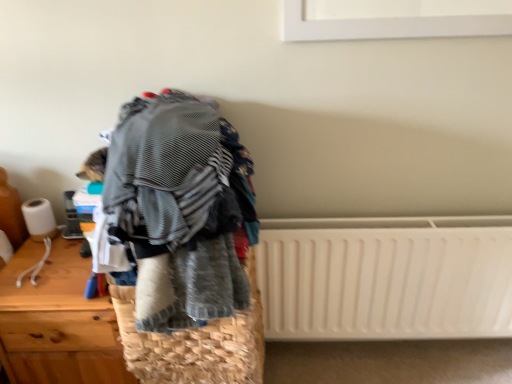
Question: Is wooden chest of drawers at left at the left side of striped fabric at center?

Choices:
 (A) no
 (B) yes

Answer: (B)

Question: Can you confirm if wooden chest of drawers at left is positioned to the right of striped fabric at center?

Choices:
 (A) yes
 (B) no

Answer: (B)

Question: Is wooden chest of drawers at left bigger than striped fabric at center?

Choices:
 (A) no
 (B) yes

Answer: (A)

Question: Does wooden chest of drawers at left have a lesser height compared to striped fabric at center?

Choices:
 (A) no
 (B) yes

Answer: (A)

Question: From the image's perspective, is wooden chest of drawers at left on top of striped fabric at center?

Choices:
 (A) no
 (B) yes

Answer: (A)

Question: Is wooden chest of drawers at left turned away from striped fabric at center?

Choices:
 (A) no
 (B) yes

Answer: (A)

Question: From the image's perspective, does woven straw basket at center appear lower than wooden chest of drawers at left?

Choices:
 (A) no
 (B) yes

Answer: (A)

Question: From a real-world perspective, is woven straw basket at center below wooden chest of drawers at left?

Choices:
 (A) no
 (B) yes

Answer: (A)

Question: Could you tell me if woven straw basket at center is turned towards wooden chest of drawers at left?

Choices:
 (A) yes
 (B) no

Answer: (B)

Question: Is woven straw basket at center positioned in front of wooden chest of drawers at left?

Choices:
 (A) yes
 (B) no

Answer: (A)

Question: Is woven straw basket at center smaller than wooden chest of drawers at left?

Choices:
 (A) no
 (B) yes

Answer: (B)

Question: Considering the relative sizes of woven straw basket at center and wooden chest of drawers at left in the image provided, is woven straw basket at center taller than wooden chest of drawers at left?

Choices:
 (A) no
 (B) yes

Answer: (A)

Question: Is wooden chest of drawers at left to the left of woven straw basket at center from the viewer's perspective?

Choices:
 (A) no
 (B) yes

Answer: (B)